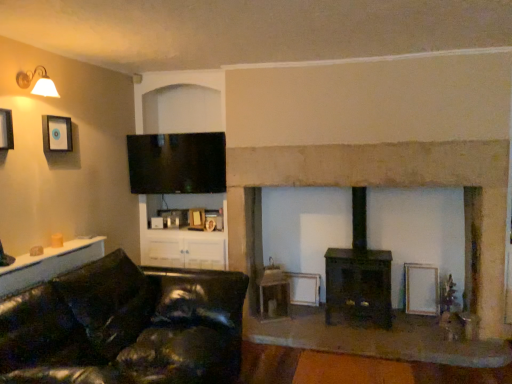
Question: Is dark brown wood burning stove at center wider than white matte picture frame at lower right, which is the 3th picture frame in front-to-back order?

Choices:
 (A) no
 (B) yes

Answer: (B)

Question: From the image's perspective, is dark brown wood burning stove at center on top of white matte picture frame at lower right, arranged as the 1th picture frame when ordered from the bottom?

Choices:
 (A) yes
 (B) no

Answer: (A)

Question: From a real-world perspective, is dark brown wood burning stove at center physically above white matte picture frame at lower right, arranged as the 1th picture frame when ordered from the bottom?

Choices:
 (A) yes
 (B) no

Answer: (A)

Question: Is dark brown wood burning stove at center bigger than white matte picture frame at lower right, arranged as the 1th picture frame when ordered from the bottom?

Choices:
 (A) no
 (B) yes

Answer: (B)

Question: Does dark brown wood burning stove at center turn towards white matte picture frame at lower right, which is the 3th picture frame in front-to-back order?

Choices:
 (A) yes
 (B) no

Answer: (B)

Question: Considering the positions of matte black picture frame at upper left, placed as the 1th picture frame when sorted from left to right, and white matte picture frame at lower right, the first picture frame positioned from the right, in the image, is matte black picture frame at upper left, placed as the 1th picture frame when sorted from left to right, wider or thinner than white matte picture frame at lower right, the first picture frame positioned from the right,?

Choices:
 (A) wide
 (B) thin

Answer: (B)

Question: In terms of size, does matte black picture frame at upper left, acting as the third picture frame starting from the back, appear bigger or smaller than white matte picture frame at lower right, placed as the 3th picture frame when sorted from left to right?

Choices:
 (A) big
 (B) small

Answer: (B)

Question: From a real-world perspective, relative to white matte picture frame at lower right, arranged as the 1th picture frame when ordered from the bottom, is matte black picture frame at upper left, placed as the 1th picture frame when sorted from left to right, vertically above or below?

Choices:
 (A) above
 (B) below

Answer: (A)

Question: Is matte black picture frame at upper left, the 1th picture frame viewed from the front, inside the boundaries of white matte picture frame at lower right, which is the 1th picture frame in back-to-front order, or outside?

Choices:
 (A) outside
 (B) inside

Answer: (A)

Question: Considering their positions, is matte white lamp at upper left located in front of or behind white matte picture frame at lower right, which is the 3th picture frame in front-to-back order?

Choices:
 (A) front
 (B) behind

Answer: (A)

Question: Considering the positions of matte white lamp at upper left and white matte picture frame at lower right, placed as the 3th picture frame when sorted from left to right, in the image, is matte white lamp at upper left wider or thinner than white matte picture frame at lower right, placed as the 3th picture frame when sorted from left to right,?

Choices:
 (A) thin
 (B) wide

Answer: (B)

Question: From the image's perspective, is matte white lamp at upper left positioned above or below white matte picture frame at lower right, placed as the 3th picture frame when sorted from left to right?

Choices:
 (A) above
 (B) below

Answer: (A)

Question: In terms of height, does matte white lamp at upper left look taller or shorter compared to white matte picture frame at lower right, acting as the third picture frame starting from the top?

Choices:
 (A) tall
 (B) short

Answer: (B)

Question: Considering the positions of point (104, 273) and point (4, 127), is point (104, 273) closer or farther from the camera than point (4, 127)?

Choices:
 (A) farther
 (B) closer

Answer: (A)

Question: Looking at the image, does black leather couch at lower left seem bigger or smaller compared to matte black picture frame at upper left, placed as the 1th picture frame when sorted from left to right?

Choices:
 (A) small
 (B) big

Answer: (B)